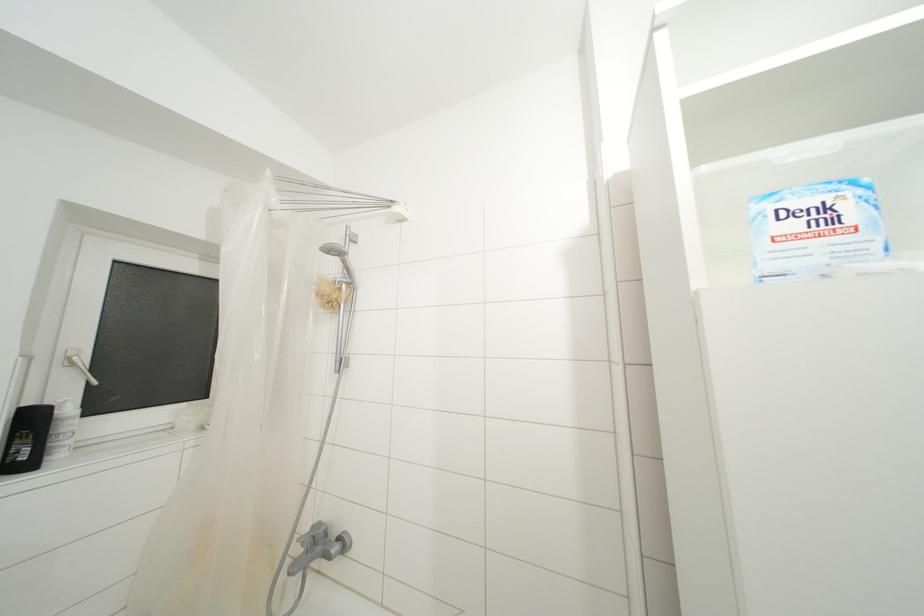
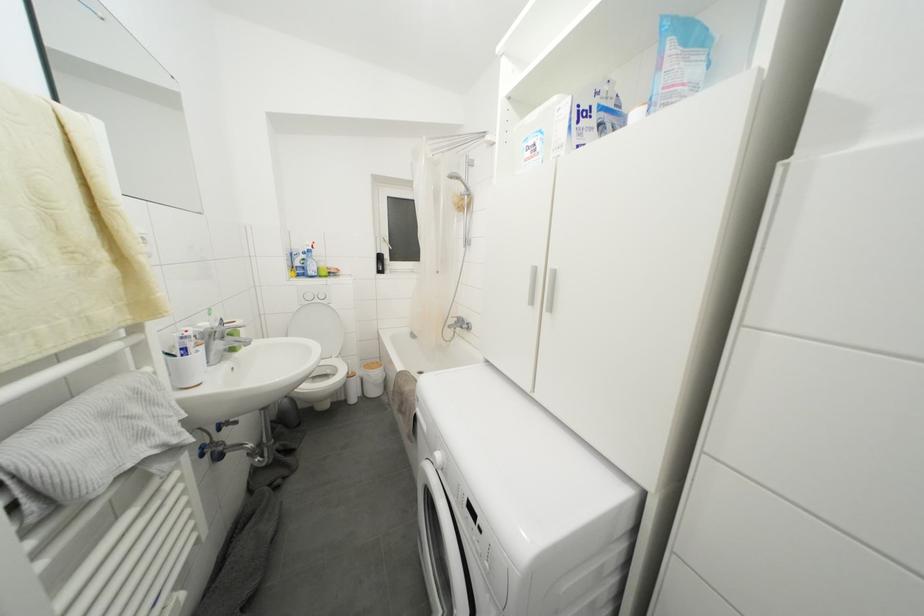
Locate, in the second image, the point that corresponds to point 840,225 in the first image.

(540, 155)